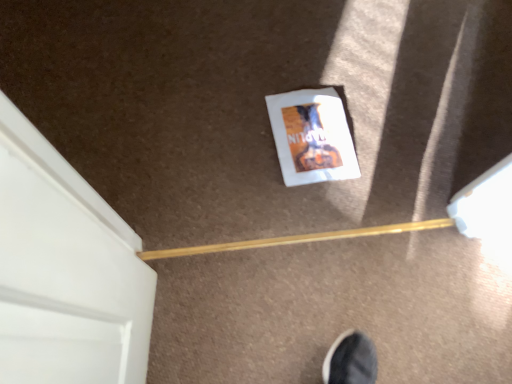
You are a GUI agent. You are given a task and a screenshot of the screen. Output one action in this format:
    pyautogui.click(x=<x>, y=<y>)
    Task: Click on the white paper flyer at center
    
    Given the screenshot: What is the action you would take?
    pyautogui.click(x=312, y=136)

The height and width of the screenshot is (384, 512). What do you see at coordinates (312, 136) in the screenshot?
I see `white paper flyer at center` at bounding box center [312, 136].

Locate an element on the screen. white paper flyer at center is located at coordinates (312, 136).